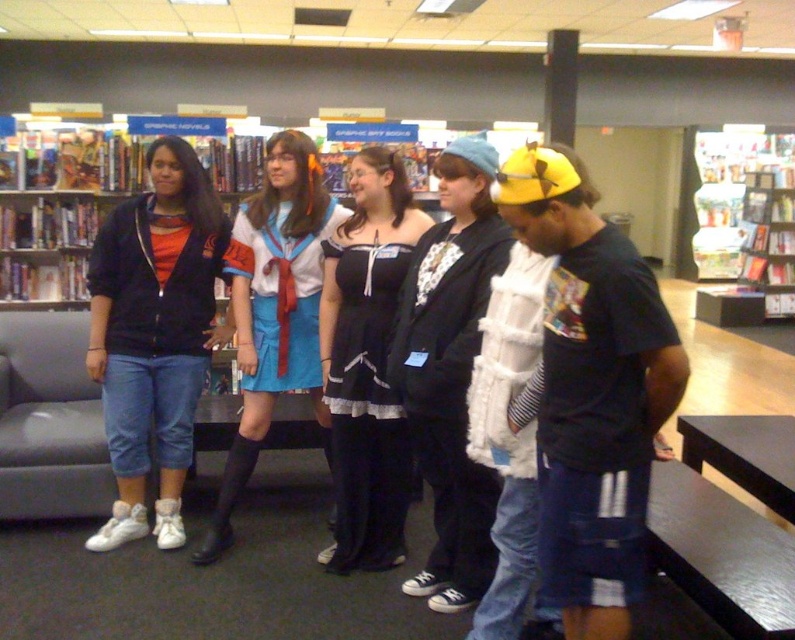
Who is shorter, matte black jacket at left or wooden bookshelf at upper right?

Standing shorter between the two is matte black jacket at left.

Between matte black jacket at left and wooden bookshelf at upper right, which one appears on the left side from the viewer's perspective?

matte black jacket at left

I want to click on matte black jacket at left, so click(154, 333).

Between yellow fabric cap at center and blue satin skirt at center, which one appears on the left side from the viewer's perspective?

Positioned to the left is blue satin skirt at center.

Can you confirm if yellow fabric cap at center is positioned to the left of blue satin skirt at center?

In fact, yellow fabric cap at center is to the right of blue satin skirt at center.

Which is behind, point (621, 336) or point (278, 160)?

Point (278, 160)

The image size is (795, 640). Identify the location of yellow fabric cap at center. (591, 390).

How far apart are matte black jacket at left and white fuzzy vest at center?

matte black jacket at left is 38.41 inches from white fuzzy vest at center.

Is matte black jacket at left to the right of white fuzzy vest at center from the viewer's perspective?

Incorrect, matte black jacket at left is not on the right side of white fuzzy vest at center.

At what (x,y) coordinates should I click in order to perform the action: click on matte black jacket at left. Please return your answer as a coordinate pair (x, y). The width and height of the screenshot is (795, 640). Looking at the image, I should click on (154, 333).